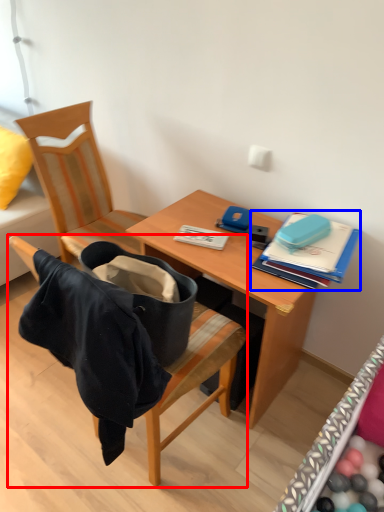
Question: Among these objects, which one is farthest to the camera, chair (highlighted by a red box) or book (highlighted by a blue box)?

Choices:
 (A) chair
 (B) book

Answer: (B)